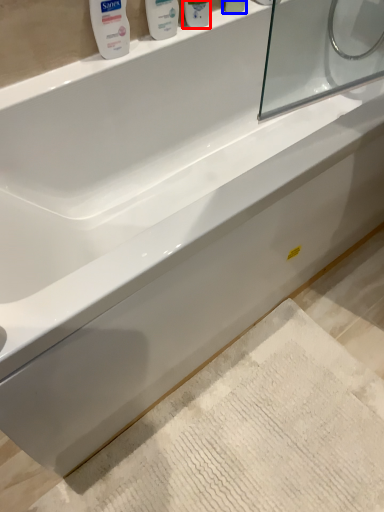
Question: Which of the following is the closest to the observer, mouthwash (highlighted by a red box) or mouthwash (highlighted by a blue box)?

Choices:
 (A) mouthwash
 (B) mouthwash

Answer: (A)